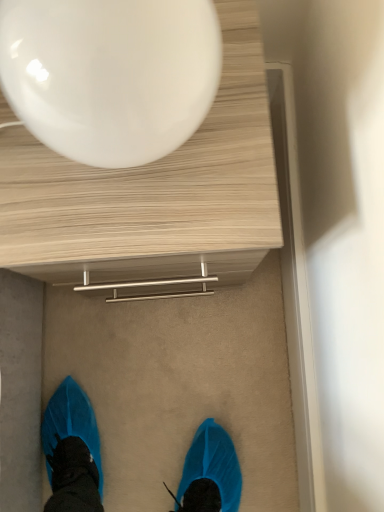
Question: Does glossy white balloon at upper center have a greater height compared to wooden table at upper center?

Choices:
 (A) no
 (B) yes

Answer: (A)

Question: Can you confirm if glossy white balloon at upper center is positioned to the left of wooden table at upper center?

Choices:
 (A) no
 (B) yes

Answer: (B)

Question: From the image's perspective, is glossy white balloon at upper center beneath wooden table at upper center?

Choices:
 (A) yes
 (B) no

Answer: (B)

Question: Considering the relative sizes of glossy white balloon at upper center and wooden table at upper center in the image provided, is glossy white balloon at upper center smaller than wooden table at upper center?

Choices:
 (A) no
 (B) yes

Answer: (B)

Question: Considering the relative sizes of glossy white balloon at upper center and wooden table at upper center in the image provided, is glossy white balloon at upper center wider than wooden table at upper center?

Choices:
 (A) yes
 (B) no

Answer: (B)

Question: Would you consider glossy white balloon at upper center to be distant from wooden table at upper center?

Choices:
 (A) no
 (B) yes

Answer: (A)

Question: Is wooden table at upper center thinner than glossy white balloon at upper center?

Choices:
 (A) no
 (B) yes

Answer: (A)

Question: Does wooden table at upper center turn towards glossy white balloon at upper center?

Choices:
 (A) yes
 (B) no

Answer: (B)

Question: Is wooden table at upper center positioned with its back to glossy white balloon at upper center?

Choices:
 (A) yes
 (B) no

Answer: (B)

Question: Can you confirm if wooden table at upper center is positioned to the left of glossy white balloon at upper center?

Choices:
 (A) no
 (B) yes

Answer: (A)

Question: Considering the relative sizes of wooden table at upper center and glossy white balloon at upper center in the image provided, is wooden table at upper center wider than glossy white balloon at upper center?

Choices:
 (A) no
 (B) yes

Answer: (B)

Question: Would you say wooden table at upper center is a long distance from glossy white balloon at upper center?

Choices:
 (A) no
 (B) yes

Answer: (A)

Question: From the image's perspective, is wooden table at upper center above or below glossy white balloon at upper center?

Choices:
 (A) below
 (B) above

Answer: (A)